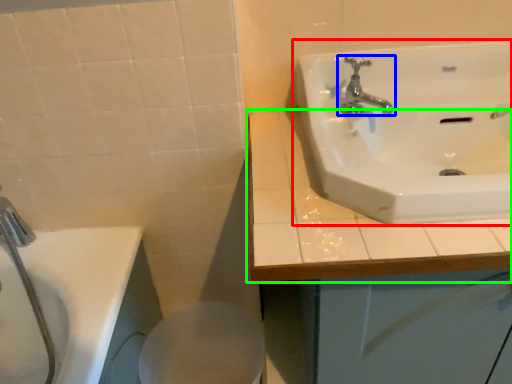
Question: Which object is positioned farthest from sink (highlighted by a red box)? Select from tap (highlighted by a blue box) and counter top (highlighted by a green box).

Choices:
 (A) tap
 (B) counter top

Answer: (B)